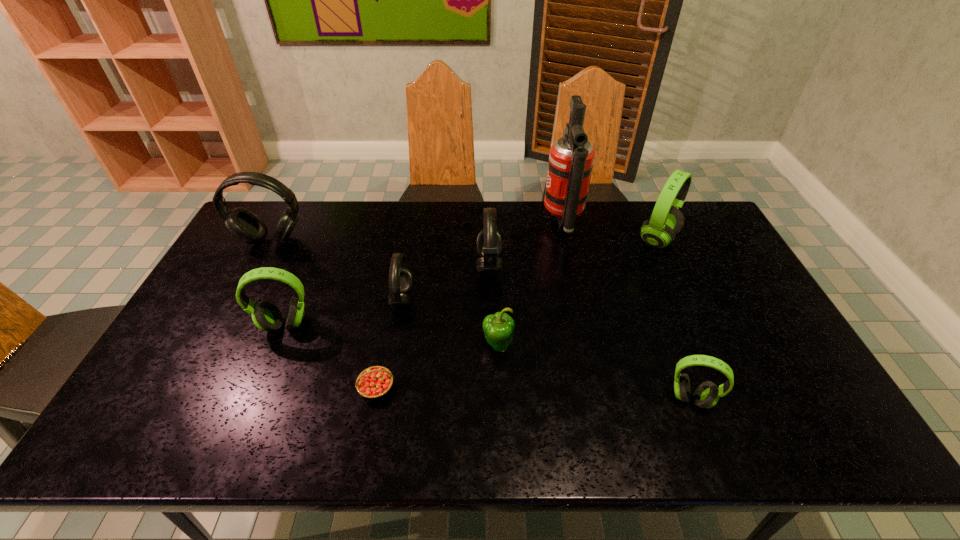
Find the location of a particular element. Image resolution: width=960 pixels, height=540 pixels. fire extinguisher is located at coordinates coord(571,158).

Where is `the tallest object`? This screenshot has width=960, height=540. the tallest object is located at coordinates (571, 158).

Find the location of a particular element. This screenshot has width=960, height=540. the biggest green headset is located at coordinates (666, 221).

Locate an element on the screen. the biggest gray headset is located at coordinates (243, 224).

Where is `the rightmost gray headset`? This screenshot has height=540, width=960. the rightmost gray headset is located at coordinates (489, 243).

Locate an element on the screen. Image resolution: width=960 pixels, height=540 pixels. the fourth headset from left to right is located at coordinates (489, 243).

What are the coordinates of `the second biggest green headset` in the screenshot? It's located at (266, 316).

Locate an element on the screen. the second farthest green headset is located at coordinates point(266,316).

You are a GUI agent. You are given a task and a screenshot of the screen. Output one action in this format:
    pyautogui.click(x=<x>, y=<y>)
    Task: Click on the second gray headset from right to left
    
    Given the screenshot: What is the action you would take?
    pyautogui.click(x=400, y=277)

Locate an element on the screen. This screenshot has width=960, height=540. the third headset from left to right is located at coordinates (400, 277).